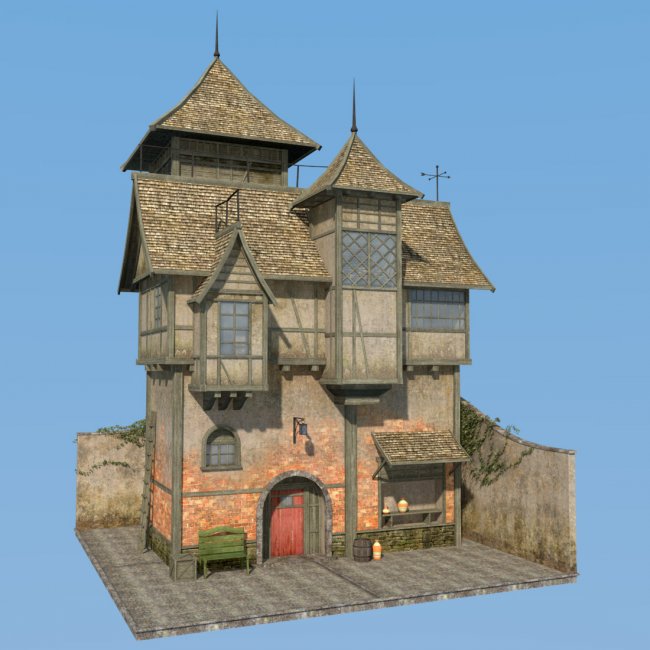
The width and height of the screenshot is (650, 650). I want to click on window, so click(x=236, y=331).